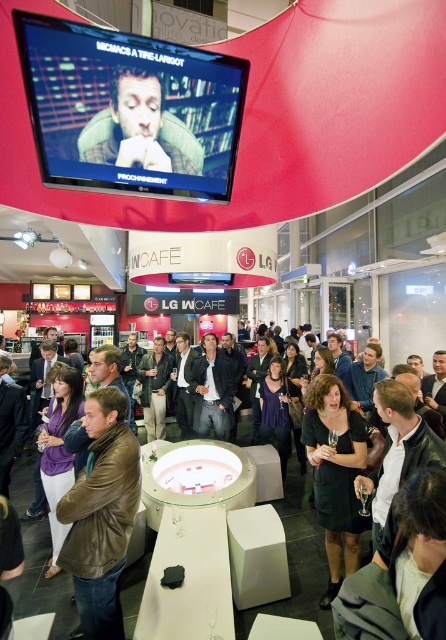
Question: In this image, where is black satin dress at center located relative to matte black face at upper center?

Choices:
 (A) above
 (B) below

Answer: (B)

Question: Is brown leather jacket at lower left thinner than black satin dress at center?

Choices:
 (A) no
 (B) yes

Answer: (A)

Question: From the image, what is the correct spatial relationship of brown leather jacket at lower left in relation to matte black face at upper center?

Choices:
 (A) right
 (B) left

Answer: (B)

Question: Which point appears closest to the camera in this image?

Choices:
 (A) (106, 115)
 (B) (104, 508)

Answer: (A)

Question: Which point is farther to the camera?

Choices:
 (A) matte black face at upper center
 (B) black satin dress at center
 (C) brown leather jacket at lower left

Answer: (B)

Question: Which point is farther from the camera taking this photo?

Choices:
 (A) (326, 596)
 (B) (111, 593)
 (C) (124, 138)

Answer: (A)